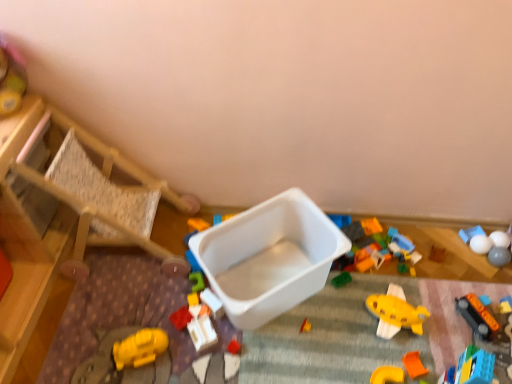
Locate an element on the screen. Image resolution: width=512 pixels, height=384 pixels. free spot in front of orange plastic train at lower right, the tenth toy in the left-to-right sequence is located at coordinates pos(488,353).